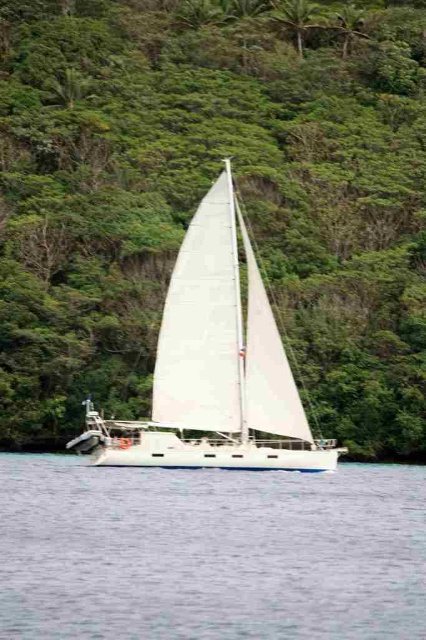
Who is higher up, green leafy tree at center or white matte sailboat at center?

Positioned higher is green leafy tree at center.

Is green leafy tree at center thinner than white matte sailboat at center?

In fact, green leafy tree at center might be wider than white matte sailboat at center.

Between point (368, 6) and point (298, 460), which one is positioned in front?

Point (298, 460) is more forward.

The height and width of the screenshot is (640, 426). Identify the location of green leafy tree at center. (203, 193).

Is clear blue water at center to the left of white matte sailboat at center from the viewer's perspective?

Correct, you'll find clear blue water at center to the left of white matte sailboat at center.

Is point (69, 477) closer to camera compared to point (198, 444)?

That is True.

Where is `clear blue water at center`? This screenshot has width=426, height=640. clear blue water at center is located at coordinates [210, 552].

Measure the distance from green leafy tree at center to clear blue water at center.

green leafy tree at center and clear blue water at center are 39.54 meters apart from each other.

Is green leafy tree at center taller than clear blue water at center?

Yes.

Where is `green leafy tree at center`? Image resolution: width=426 pixels, height=640 pixels. green leafy tree at center is located at coordinates pos(203,193).